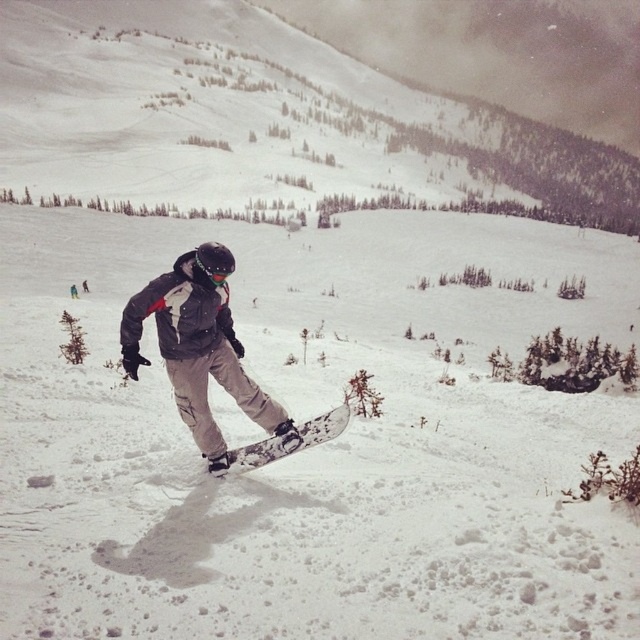
Is the position of matte black snowboard at center more distant than that of camouflage-patterned snowboard at center?

No, matte black snowboard at center is in front of camouflage-patterned snowboard at center.

Can you confirm if matte black snowboard at center is taller than camouflage-patterned snowboard at center?

Yes.

Who is more forward, (x=168, y=374) or (x=326, y=420)?

Positioned in front is point (x=168, y=374).

I want to click on matte black snowboard at center, so click(x=211, y=360).